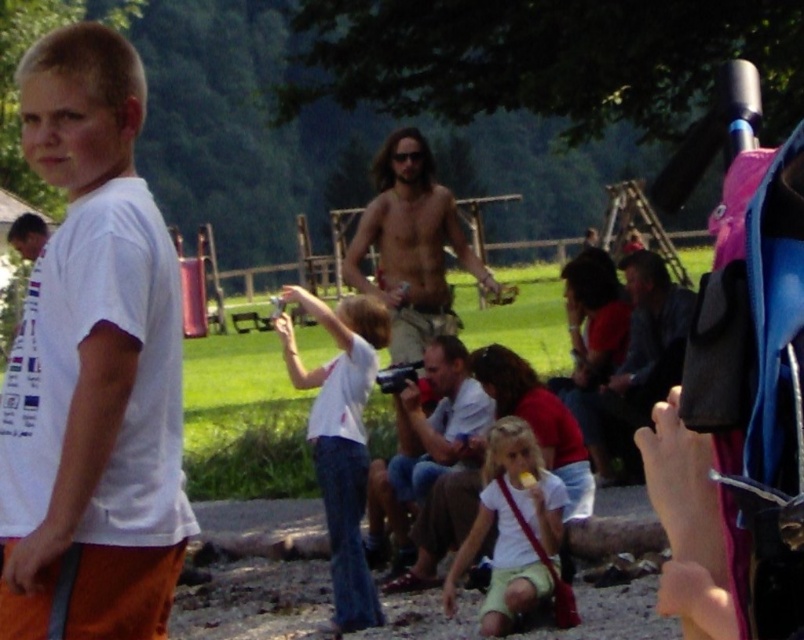
Question: Can you confirm if white matte t-shirt at left is positioned to the right of white matte shirt at center?

Choices:
 (A) no
 (B) yes

Answer: (A)

Question: Estimate the real-world distances between objects in this image. Which object is farther from the matte white camera at center?

Choices:
 (A) white matte t-shirt at left
 (B) white matte shirt at center
 (C) beige textured shorts at center

Answer: (A)

Question: Observing the image, what is the correct spatial positioning of white cotton shirt at center in reference to dark blue jeans at center?

Choices:
 (A) right
 (B) left

Answer: (B)

Question: Which point appears closest to the camera in this image?

Choices:
 (A) (372, 500)
 (B) (52, 308)
 (C) (453, 205)

Answer: (B)

Question: Among these objects, which one is farthest from the camera?

Choices:
 (A) matte white camera at center
 (B) white matte t-shirt at left
 (C) dark blue jeans at center

Answer: (C)

Question: Is white matte t-shirt at left to the right of white matte shirt at center from the viewer's perspective?

Choices:
 (A) yes
 (B) no

Answer: (B)